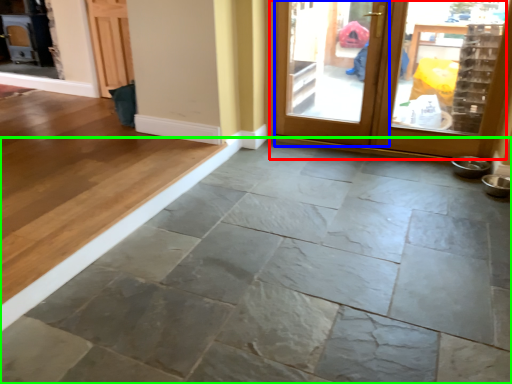
Question: Which is farther away from door (highlighted by a red box)? screen door (highlighted by a blue box) or concrete (highlighted by a green box)?

Choices:
 (A) screen door
 (B) concrete

Answer: (B)